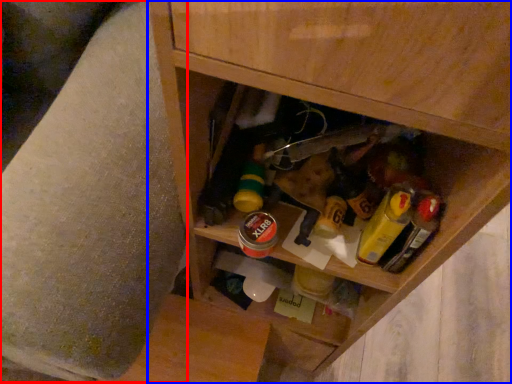
Question: Among these objects, which one is farthest to the camera, swivel chair (highlighted by a red box) or cabinetry (highlighted by a blue box)?

Choices:
 (A) swivel chair
 (B) cabinetry

Answer: (B)